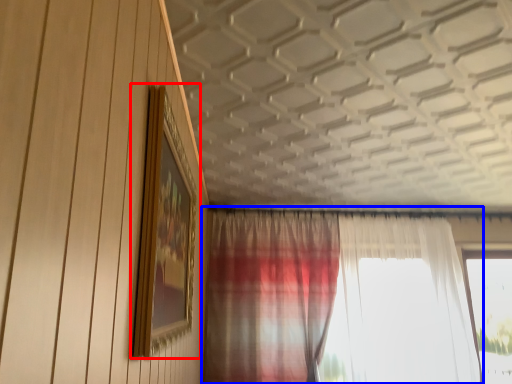
Question: Which of the following is the closest to the observer, picture frame (highlighted by a red box) or curtain (highlighted by a blue box)?

Choices:
 (A) picture frame
 (B) curtain

Answer: (A)